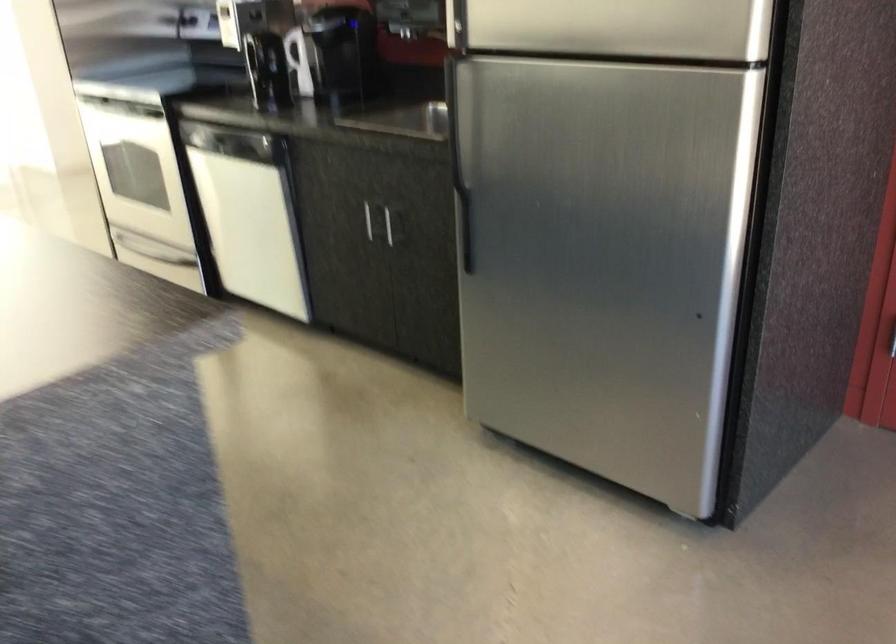
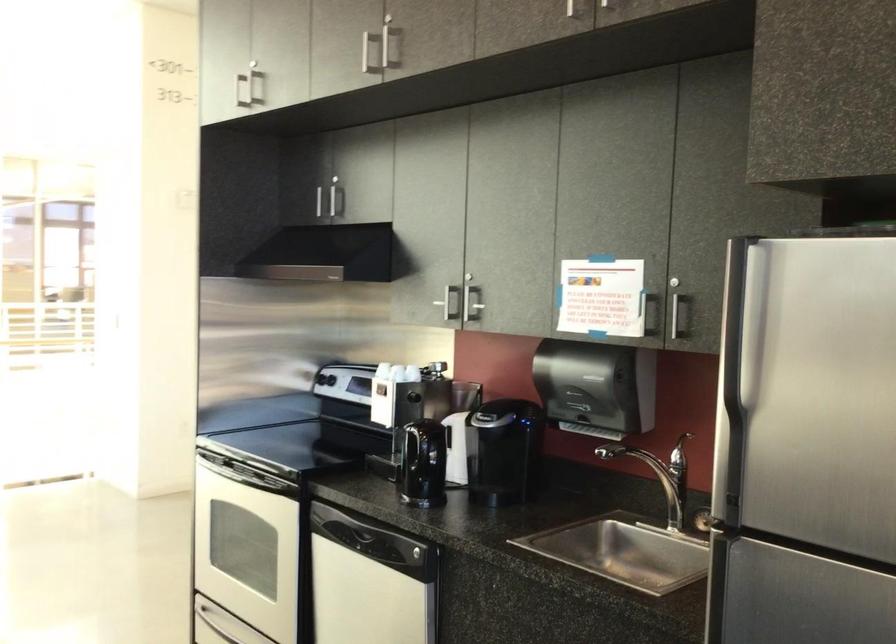
Question: The first image is from the beginning of the video and the second image is from the end. How did the camera likely rotate when shooting the video?

Choices:
 (A) Left
 (B) Right
 (C) Up
 (D) Down

Answer: (C)